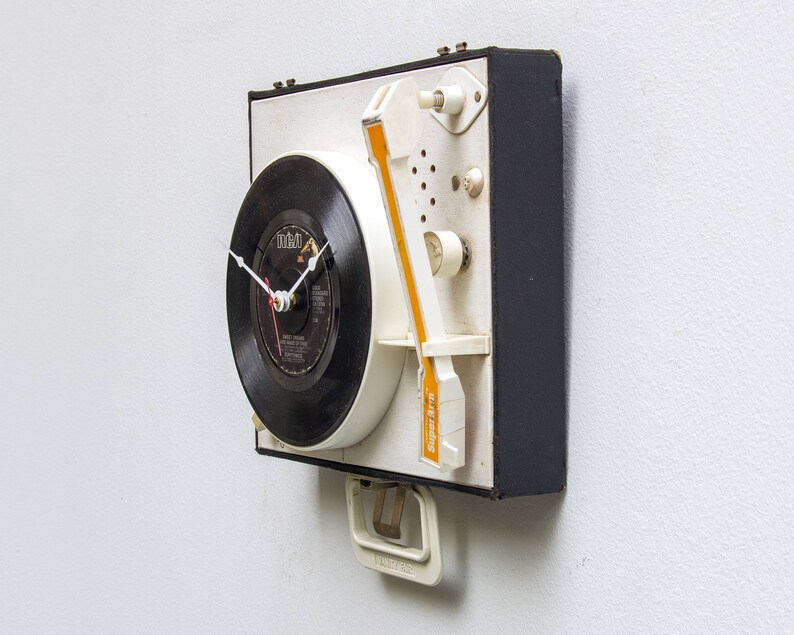
At what (x,y) coordinates should I click in order to perform the action: click on speaker. Please return your answer as a coordinate pair (x, y). Looking at the image, I should click on (426, 185).